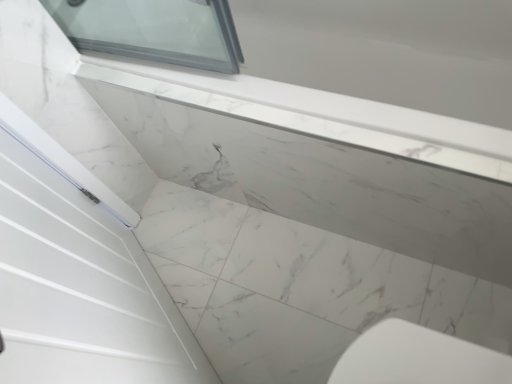
Describe the element at coordinates (298, 288) in the screenshot. I see `white marble countertop at upper center` at that location.

Locate an element on the screen. The image size is (512, 384). white marble countertop at upper center is located at coordinates (298, 288).

At what (x,y) coordinates should I click in order to perform the action: click on white marble window sill at upper center. Please return your answer as a coordinate pair (x, y). The width and height of the screenshot is (512, 384). Looking at the image, I should click on (320, 114).

What do you see at coordinates (320, 114) in the screenshot? Image resolution: width=512 pixels, height=384 pixels. I see `white marble window sill at upper center` at bounding box center [320, 114].

Where is `white marble countertop at upper center`? The width and height of the screenshot is (512, 384). white marble countertop at upper center is located at coordinates (298, 288).

Between white marble countertop at upper center and white marble window sill at upper center, which one appears on the right side from the viewer's perspective?

white marble window sill at upper center.

Does white marble countertop at upper center lie behind white marble window sill at upper center?

Yes, it is behind white marble window sill at upper center.

In the scene shown: Which point is more forward, (217, 231) or (488, 128)?

The point (488, 128) is closer.

From the image's perspective, between white marble countertop at upper center and white marble window sill at upper center, which one is located above?

From the image's view, white marble window sill at upper center is above.

From a real-world perspective, is white marble countertop at upper center positioned over white marble window sill at upper center based on gravity?

No, from a real-world perspective, white marble countertop at upper center is not over white marble window sill at upper center

Does white marble countertop at upper center have a greater width compared to white marble window sill at upper center?

Indeed, white marble countertop at upper center has a greater width compared to white marble window sill at upper center.

Between white marble countertop at upper center and white marble window sill at upper center, which one has more height?

white marble window sill at upper center.

Considering the relative sizes of white marble countertop at upper center and white marble window sill at upper center in the image provided, is white marble countertop at upper center bigger than white marble window sill at upper center?

Actually, white marble countertop at upper center might be smaller than white marble window sill at upper center.

Is white marble countertop at upper center outside of white marble window sill at upper center?

Indeed, white marble countertop at upper center is completely outside white marble window sill at upper center.

Is white marble countertop at upper center far away from white marble window sill at upper center?

No, white marble countertop at upper center is in close proximity to white marble window sill at upper center.

Does white marble countertop at upper center turn towards white marble window sill at upper center?

No, white marble countertop at upper center is not facing towards white marble window sill at upper center.

Based on the photo, measure the distance from white marble countertop at upper center to white marble window sill at upper center.

A distance of 23.47 inches exists between white marble countertop at upper center and white marble window sill at upper center.

Identify the location of window sill above the white marble countertop at upper center (from the image's perspective). (320, 114).

Which object is positioned more to the left, white marble window sill at upper center or white marble countertop at upper center?

From the viewer's perspective, white marble countertop at upper center appears more on the left side.

Is the position of white marble window sill at upper center more distant than that of white marble countertop at upper center?

No, it is in front of white marble countertop at upper center.

Which point is more forward, (486, 174) or (274, 363)?

The point (486, 174) is in front.

From the image's perspective, is white marble window sill at upper center under white marble countertop at upper center?

Actually, white marble window sill at upper center appears above white marble countertop at upper center in the image.

From a real-world perspective, relative to white marble countertop at upper center, is white marble window sill at upper center vertically above or below?

In terms of real-world spatial position, white marble window sill at upper center is above white marble countertop at upper center.

Considering the sizes of objects white marble window sill at upper center and white marble countertop at upper center in the image provided, who is wider, white marble window sill at upper center or white marble countertop at upper center?

white marble countertop at upper center.

Considering the sizes of objects white marble window sill at upper center and white marble countertop at upper center in the image provided, who is taller, white marble window sill at upper center or white marble countertop at upper center?

With more height is white marble window sill at upper center.

Is white marble window sill at upper center smaller than white marble countertop at upper center?

Actually, white marble window sill at upper center might be larger than white marble countertop at upper center.

Based on the photo, is white marble window sill at upper center located outside white marble countertop at upper center?

Indeed, white marble window sill at upper center is completely outside white marble countertop at upper center.

Is white marble window sill at upper center not close to white marble countertop at upper center?

That's not correct — white marble window sill at upper center is a little close to white marble countertop at upper center.

Is white marble window sill at upper center facing away from white marble countertop at upper center?

white marble window sill at upper center is not turned away from white marble countertop at upper center.

How many degrees apart are the facing directions of white marble window sill at upper center and white marble countertop at upper center?

They differ by 90.1 degrees in their facing directions.

The image size is (512, 384). In order to click on window sill above the white marble countertop at upper center (from a real-world perspective) in this screenshot , I will do [320, 114].

Locate an element on the screen. Image resolution: width=512 pixels, height=384 pixels. window sill that appears above the white marble countertop at upper center (from the image's perspective) is located at coordinates (320, 114).

Locate an element on the screen. The width and height of the screenshot is (512, 384). window sill in front of the white marble countertop at upper center is located at coordinates (320, 114).